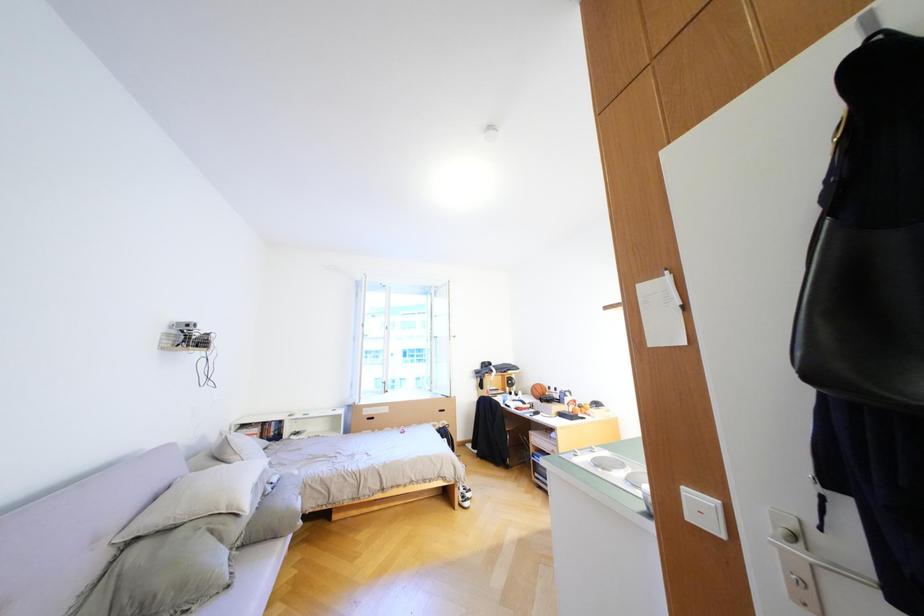
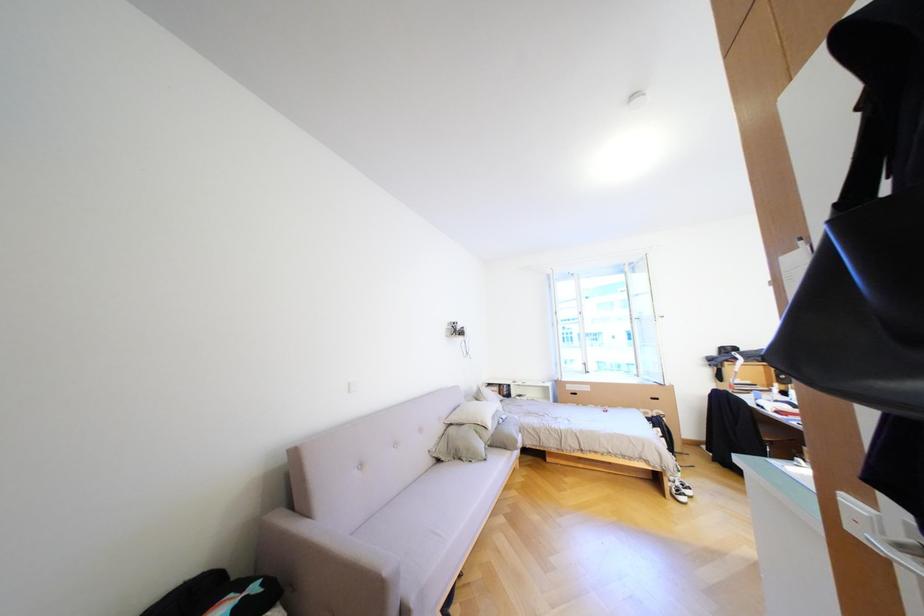
Question: The camera is either moving clockwise (left) or counter-clockwise (right) around the object. The first image is from the beginning of the video and the second image is from the end. Is the camera moving left or right when shooting the video?

Choices:
 (A) Left
 (B) Right

Answer: (B)